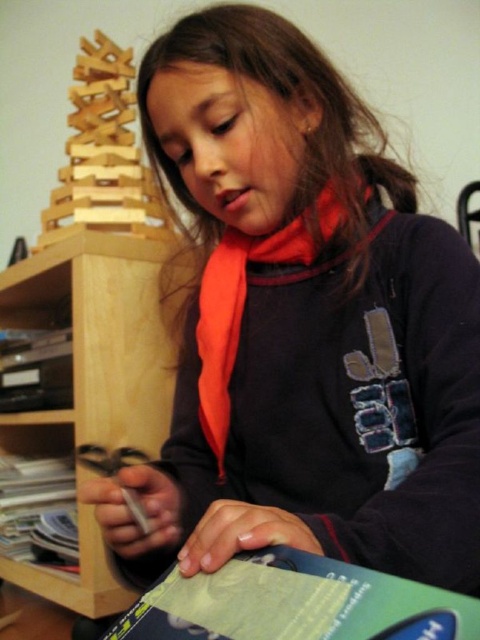
Question: Does green matte book at lower center appear over green matte book at lower left?

Choices:
 (A) no
 (B) yes

Answer: (B)

Question: Which point is closer to the camera?

Choices:
 (A) green matte book at lower left
 (B) wooden bookshelf at left
 (C) wooden blocks at upper left

Answer: (B)

Question: Among these objects, which one is nearest to the camera?

Choices:
 (A) wooden bookshelf at left
 (B) green matte book at lower left
 (C) green matte book at lower center
 (D) wooden blocks at upper left

Answer: (C)

Question: Is green matte book at lower center wider than green matte book at lower left?

Choices:
 (A) yes
 (B) no

Answer: (B)

Question: Which object appears farthest from the camera in this image?

Choices:
 (A) wooden blocks at upper left
 (B) green matte book at lower left
 (C) wooden bookshelf at left

Answer: (A)

Question: Does green matte book at lower center appear under wooden blocks at upper left?

Choices:
 (A) yes
 (B) no

Answer: (A)